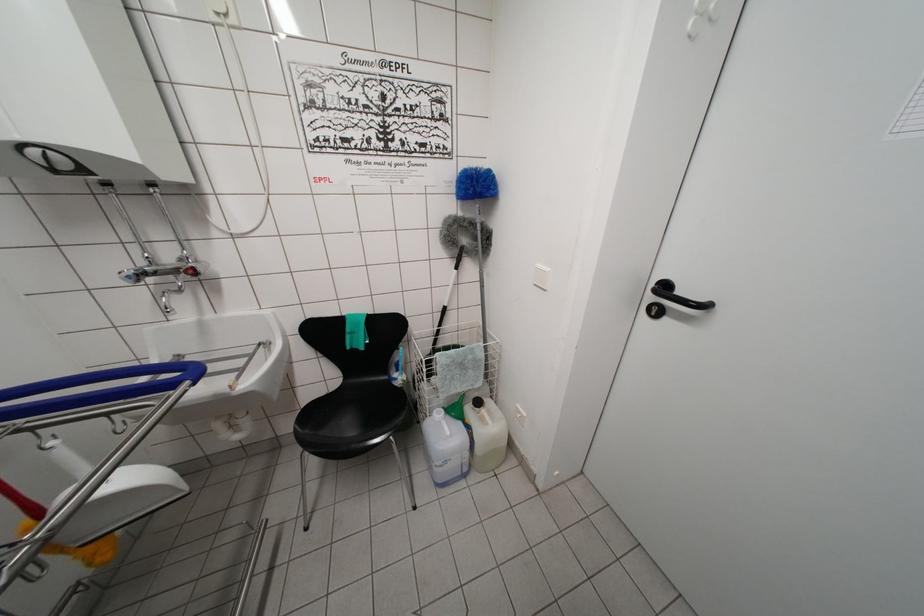
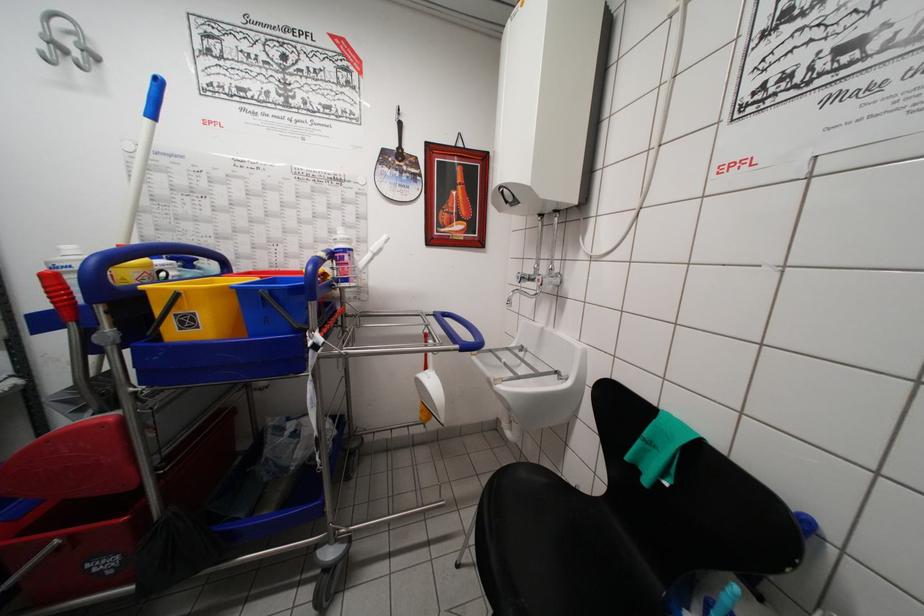
Where in the second image is the point corresponding to [57,176] from the first image?

(511, 207)